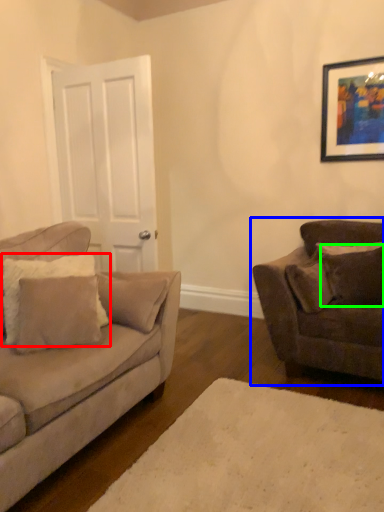
Question: Which object is the closest to the pillow (highlighted by a red box)? Choose among these: studio couch (highlighted by a blue box) or pillow (highlighted by a green box).

Choices:
 (A) studio couch
 (B) pillow

Answer: (A)